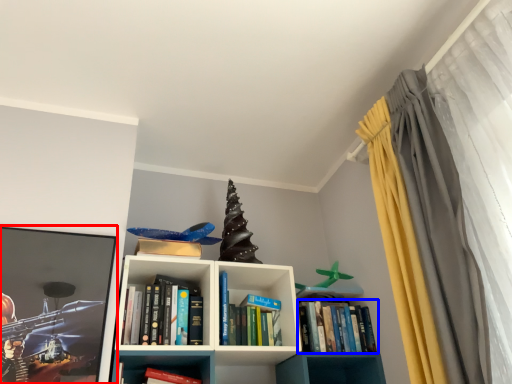
Question: Among these objects, which one is farthest to the camera, picture frame (highlighted by a red box) or book (highlighted by a blue box)?

Choices:
 (A) picture frame
 (B) book

Answer: (B)